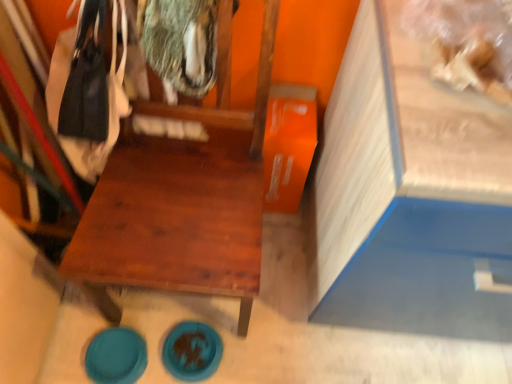
This screenshot has height=384, width=512. Identify the location of vacant location below blue matte plate at lower center, which is counted as the 1th plate, starting from the right (from a real-world perspective). (189, 360).